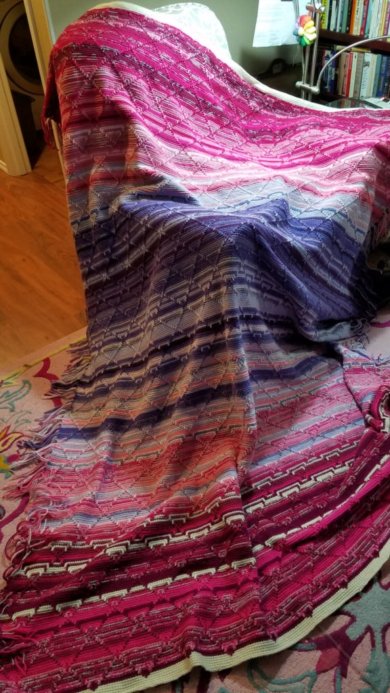
Where is `rug`? rug is located at coordinates (151, 612).